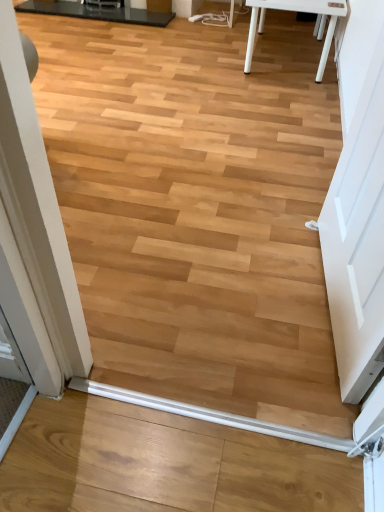
Identify the location of free point above white plastic beam at lower center (from a real-world perspective). The height and width of the screenshot is (512, 384). (211, 411).